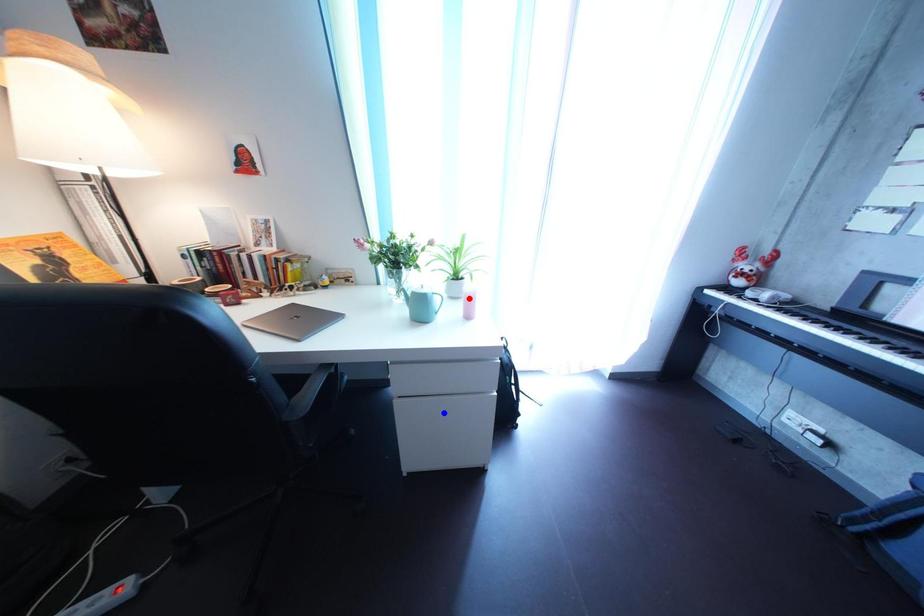
Question: Which of the two points in the image is closer to the camera?

Choices:
 (A) Blue point is closer.
 (B) Red point is closer.

Answer: (A)